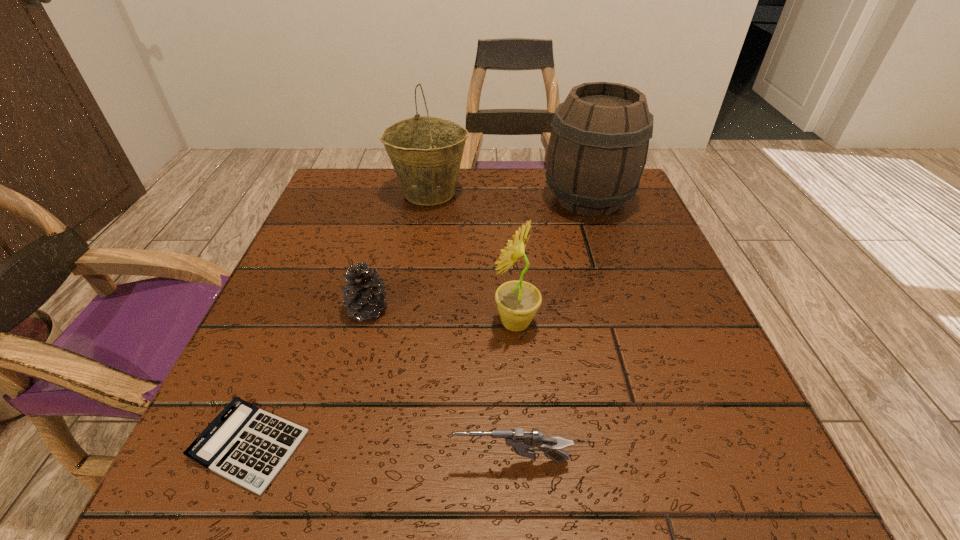
Where is `vacant area situated 0.340m on the face of the third tallest object`? The height and width of the screenshot is (540, 960). vacant area situated 0.340m on the face of the third tallest object is located at coordinates (296, 323).

The image size is (960, 540). Find the location of `vacant point located 0.070m on the left of the third shortest object`. vacant point located 0.070m on the left of the third shortest object is located at coordinates (306, 309).

Find the location of `free region located at the barrel of the fifth tallest object`. free region located at the barrel of the fifth tallest object is located at coordinates (204, 461).

The image size is (960, 540). What are the coordinates of `vacant space located 0.300m at the barrel of the fifth tallest object` in the screenshot? It's located at (228, 461).

Where is `free space located 0.280m at the barrel of the fifth tallest object`? The image size is (960, 540). free space located 0.280m at the barrel of the fifth tallest object is located at coordinates (243, 461).

Locate an element on the screen. free spot located on the back of the calculator is located at coordinates (308, 301).

At what (x,y) coordinates should I click in order to perform the action: click on gun located at the near edge. Please return your answer as a coordinate pair (x, y). The image size is (960, 540). Looking at the image, I should click on (522, 442).

You are a GUI agent. You are given a task and a screenshot of the screen. Output one action in this format:
    pyautogui.click(x=<x>, y=<y>)
    Task: Click on the calculator located in the near edge section of the desktop
    
    Given the screenshot: What is the action you would take?
    pyautogui.click(x=248, y=446)

Where is `pinecone present at the left edge`? pinecone present at the left edge is located at coordinates (364, 293).

What are the coordinates of `calculator positioned at the left edge` in the screenshot? It's located at (248, 446).